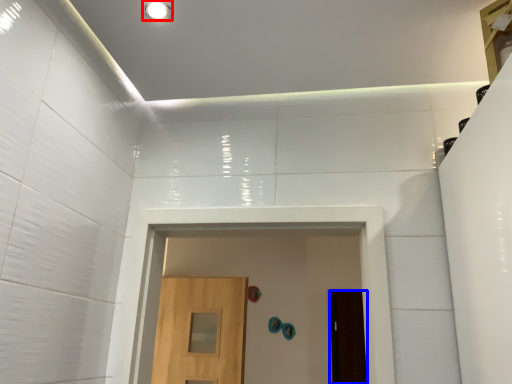
Question: Which object is further to the camera taking this photo, lighting (highlighted by a red box) or door (highlighted by a blue box)?

Choices:
 (A) lighting
 (B) door

Answer: (B)